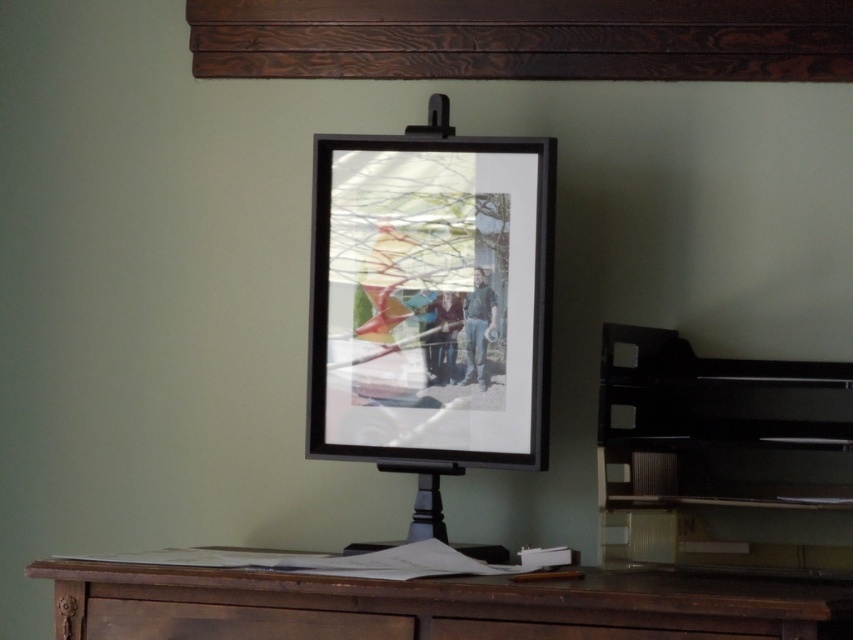
Please see the image. There is a point at coordinates (x=722, y=458). What object is located at this point?

The point at coordinates (x=722, y=458) corresponds to the black matte easel at center.

You are standing in front of a wooden desk with a dark wooden easel. There is a point marked at coordinates [430,300]. What object is located at that point?

The point at coordinates [430,300] marks the location of the black matte picture frame at center.

You are standing at the edge of the desk looking towards the piano. There are two points marked on the desk surface, point A at point (821, 394) and point B at point (154, 582). Which point is closer to you?

Point B at point (154, 582) is closer to you because point A at point (821, 394) is behind it.